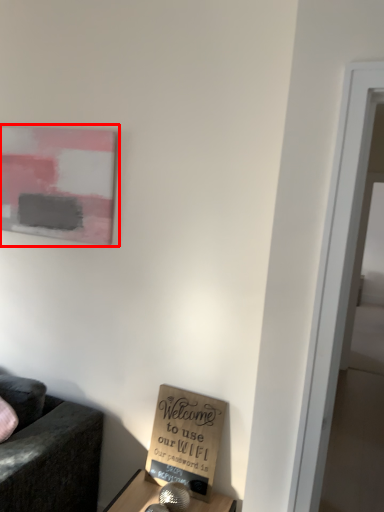
Question: From the image's perspective, what is the correct spatial positioning of picture frame (annotated by the red box) in reference to cardboard box?

Choices:
 (A) below
 (B) above

Answer: (B)